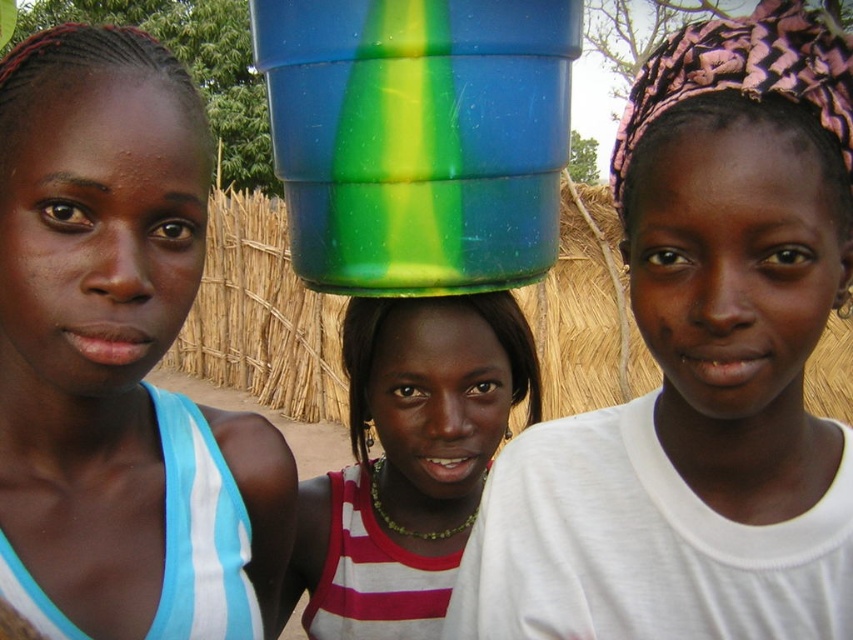
Question: Is matte plastic bucket at upper center positioned at the back of green plastic bucket at center?

Choices:
 (A) yes
 (B) no

Answer: (B)

Question: Which object is the farthest from the matte black hair at upper left?

Choices:
 (A) pink woven fabric at center
 (B) matte plastic bucket at upper center
 (C) green translucent bucket at center
 (D) green plastic bucket at center

Answer: (C)

Question: Is green plastic bucket at center above pink woven fabric at center?

Choices:
 (A) yes
 (B) no

Answer: (B)

Question: Which point appears farthest from the camera in this image?

Choices:
 (A) (54, 429)
 (B) (527, 525)
 (C) (454, 524)

Answer: (C)

Question: Can you confirm if matte blue tank top at left is wider than green plastic bucket at center?

Choices:
 (A) yes
 (B) no

Answer: (B)

Question: Which point is closer to the camera?

Choices:
 (A) matte blue tank top at left
 (B) pink woven fabric at center
 (C) green translucent bucket at center

Answer: (B)